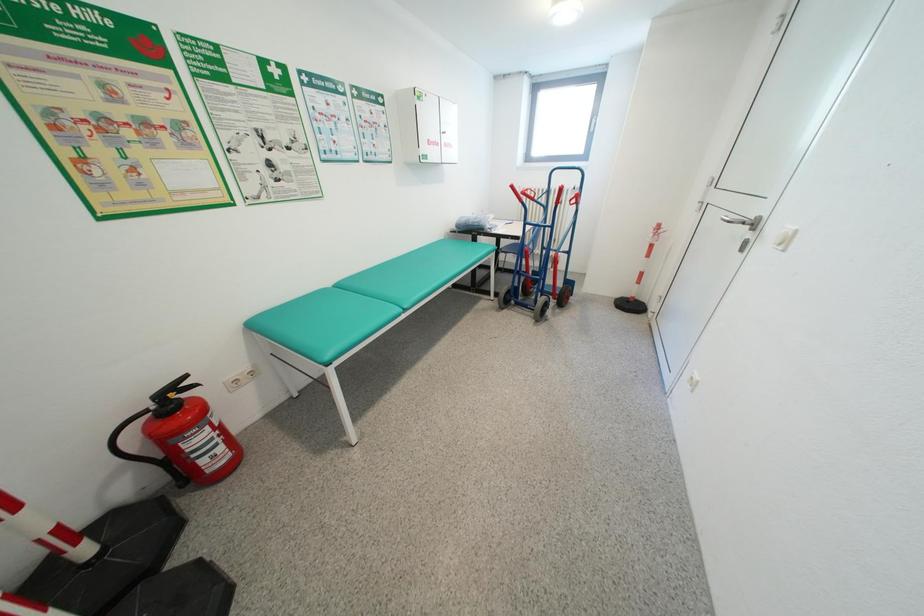
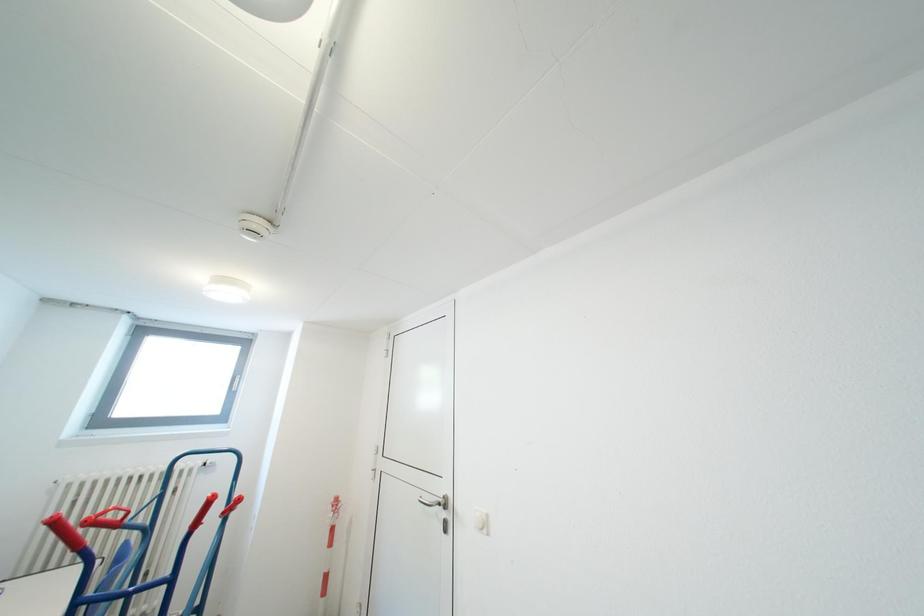
The images are taken continuously from a first-person perspective. In which direction is your viewpoint rotating?

The camera rotated toward right-up.